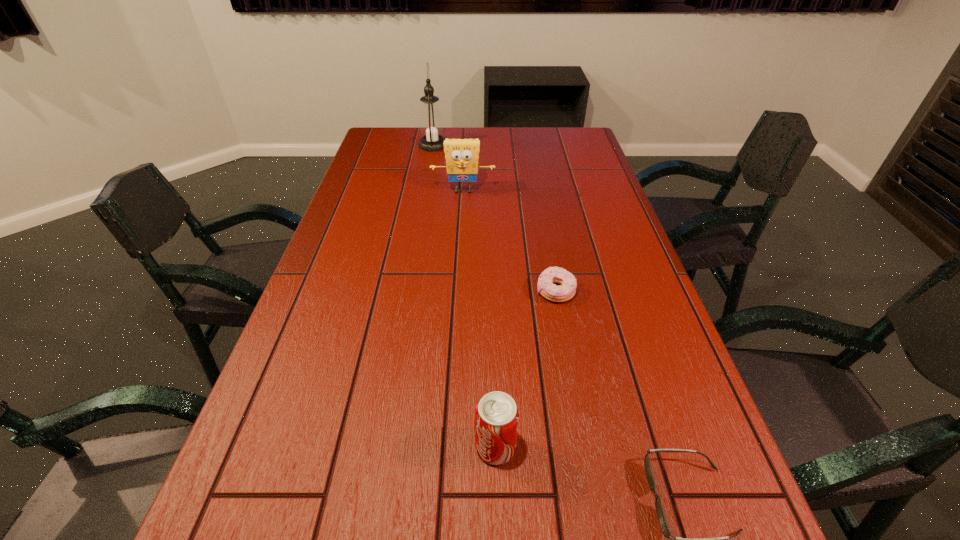
This screenshot has width=960, height=540. In order to click on vacant position located on the front of the third nearest object in this screenshot , I will do `click(574, 393)`.

The width and height of the screenshot is (960, 540). Identify the location of object situated at the far edge. (431, 124).

You are a GUI agent. You are given a task and a screenshot of the screen. Output one action in this format:
    pyautogui.click(x=<x>, y=<y>)
    Task: Click on the vacant space at the far edge of the desktop
    The image size is (960, 540).
    Given the screenshot: What is the action you would take?
    pyautogui.click(x=455, y=127)

The height and width of the screenshot is (540, 960). In the image, there is a desktop. What are the coordinates of `free space at the left edge` in the screenshot? It's located at (314, 444).

What are the coordinates of `vacant space at the right edge of the desktop` in the screenshot? It's located at (647, 330).

This screenshot has height=540, width=960. In the image, there is a desktop. Find the location of `free space at the far left corner`. free space at the far left corner is located at coordinates (404, 134).

Find the location of a particular element. unoccupied area between the oil lamp and the soda can is located at coordinates (465, 296).

Find the location of a particular element. The width and height of the screenshot is (960, 540). empty space between the tallest object and the soda can is located at coordinates (465, 296).

At what (x,y) coordinates should I click in order to perform the action: click on free space between the sponge and the third shortest object. Please return your answer as a coordinate pair (x, y). Looking at the image, I should click on (479, 319).

At what (x,y) coordinates should I click in order to perform the action: click on empty space between the third farthest object and the tallest object. Please return your answer as a coordinate pair (x, y). Looking at the image, I should click on (494, 219).